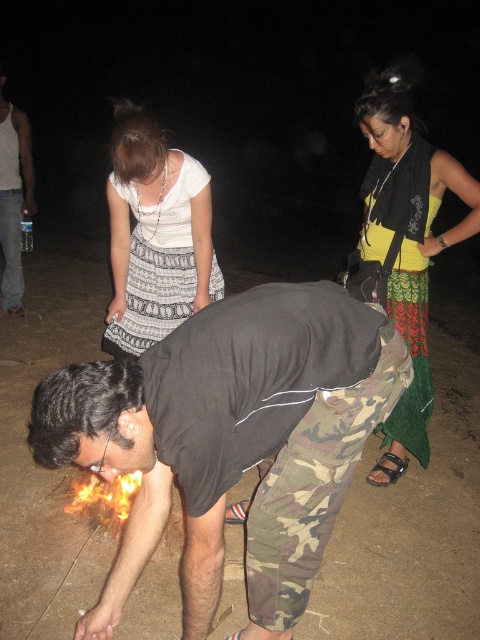
You are standing in the nighttime scene and want to find the white tank top at left. According to the coordinates provided, where should you look to locate it?

The white tank top at left is located at coordinates point (13,195).